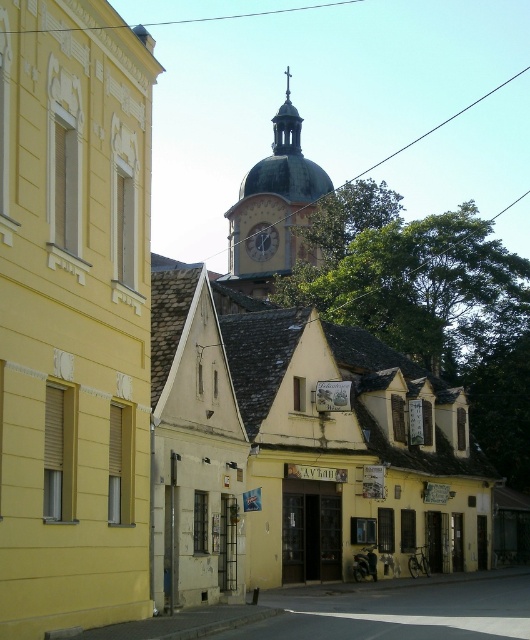
You are a tourist standing on the street and want to take a photo of both the golden dome clock tower at upper center and the gold metallic clock at center. Which object should you frame first in your camera to ensure both are fully visible in the photo?

To ensure both the golden dome clock tower at upper center and the gold metallic clock at center are fully visible, you should frame the golden dome clock tower at upper center first since it might be wider than the gold metallic clock at center, requiring more space in the photo.

You are an architect analyzing the proportions of the buildings in the image. Which structure has a greater width between the yellow stucco church at center and the golden dome clock tower at upper center?

The golden dome clock tower at upper center has a greater width than the yellow stucco church at center.